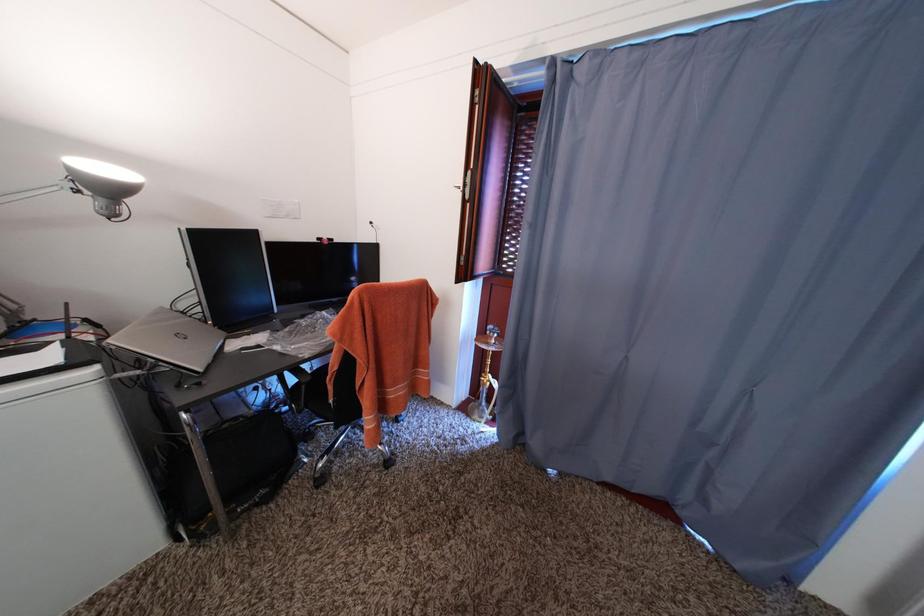
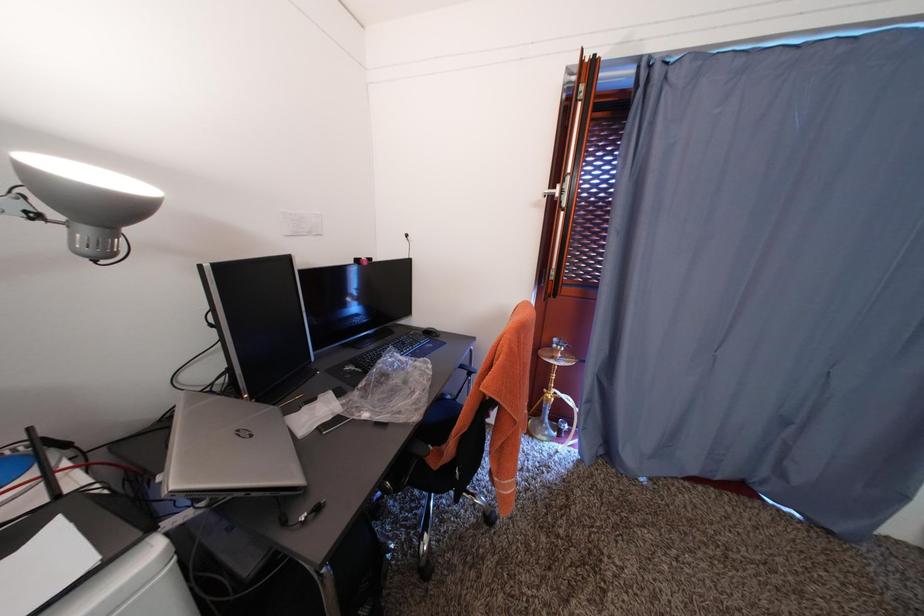
What movement of the cameraman would produce the second image?

The movement direction of the cameraman is left, forward.